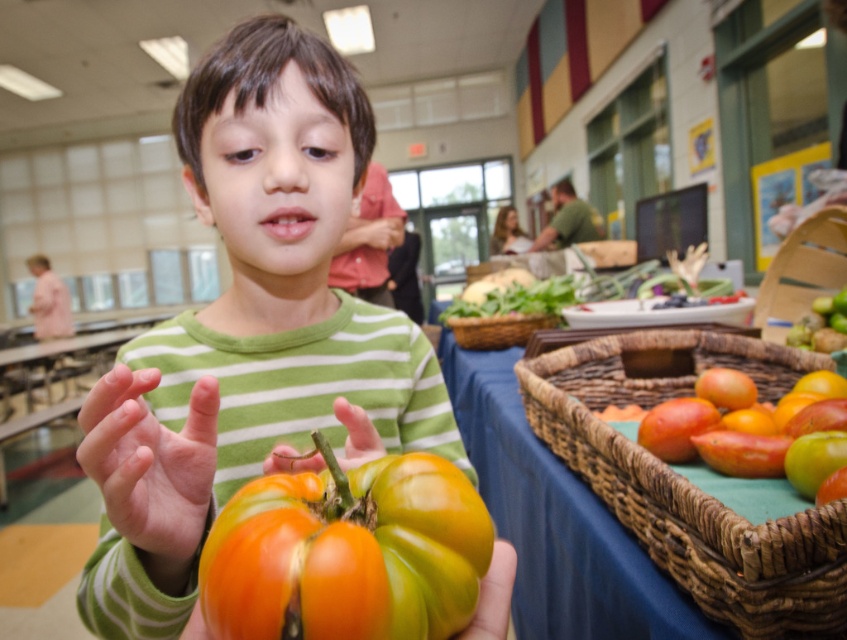
You are a vendor at a market and need to place a large tomato on a basket. Which basket, the woven brown basket at lower right or the brown woven basket at center, can accommodate the tomato better based on their heights?

The woven brown basket at lower right has a greater height compared to the brown woven basket at center, so it can accommodate the tomato better.

You are a photographer trying to capture the boy holding the tomato. You notice the pale skin at center and the smooth green hand at center in your frame. Which object should you focus on to ensure the closer one is sharp?

The pale skin at center is closer to the viewer than the smooth green hand at center, so you should focus on the pale skin at center to ensure the closer one is sharp.